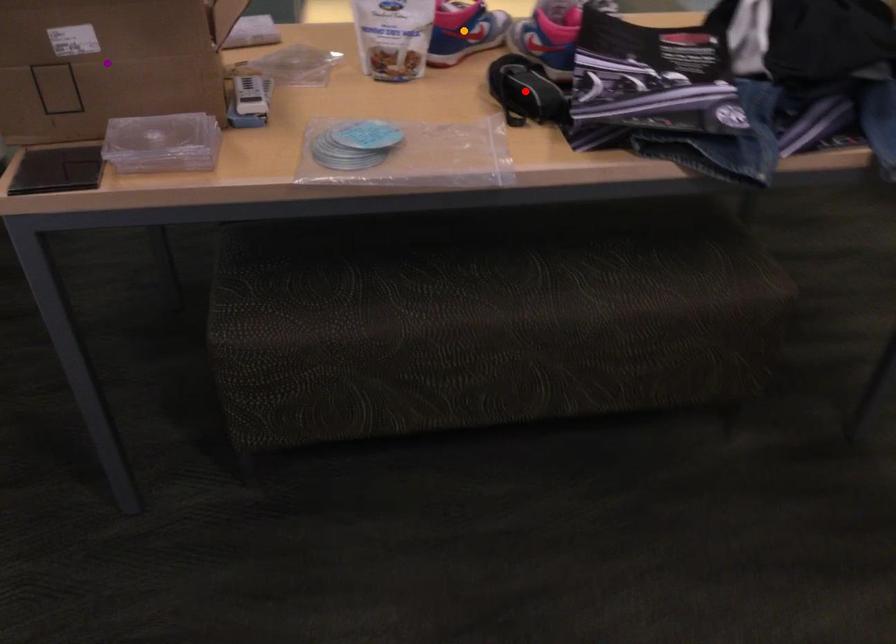
Order these from nearest to farthest:
red point, purple point, orange point

purple point < red point < orange point